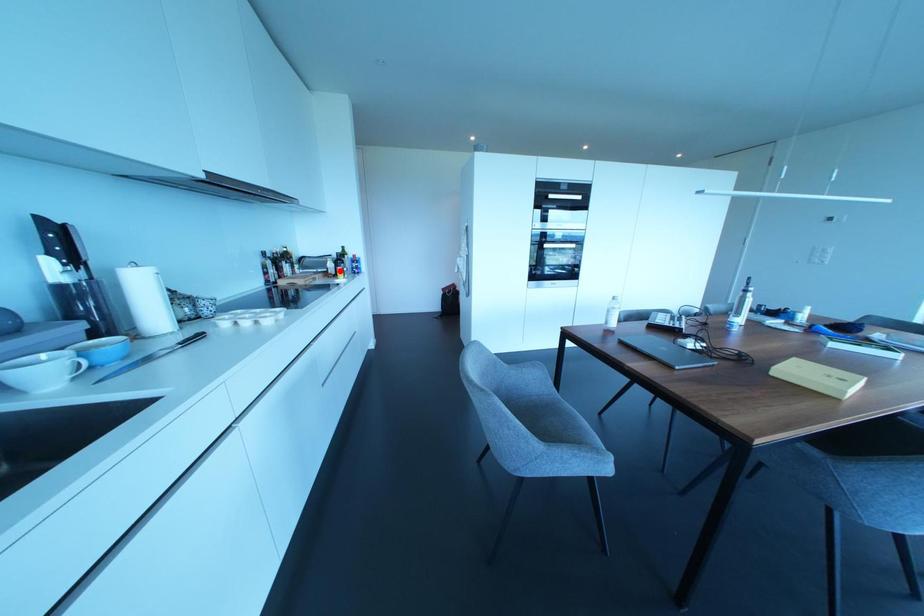
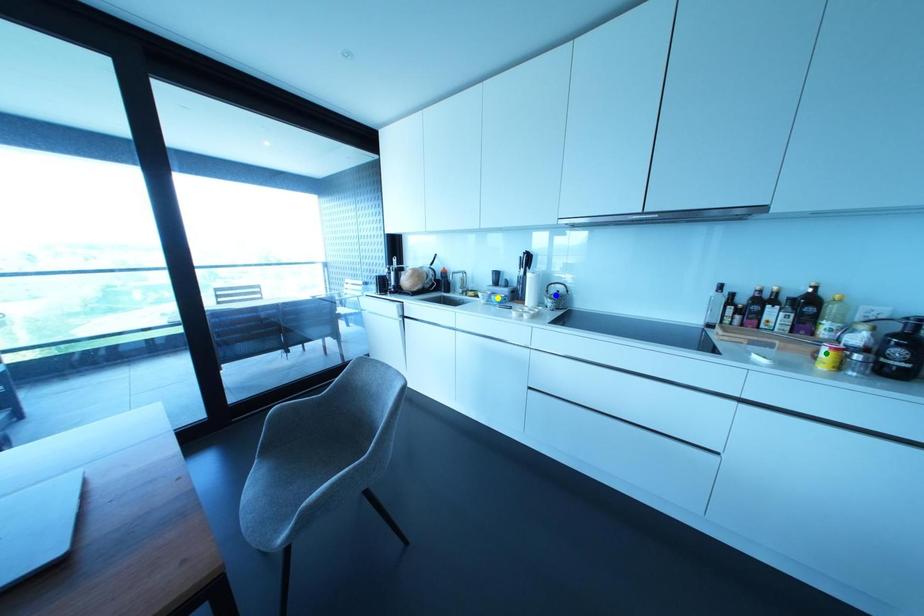
Question: I am providing you with two images of the same scene from different viewpoints. A red point is marked on the first image. You are given multiple points on the second image. Which mark in image 2 goes with the point in image 1?

Choices:
 (A) blue point
 (B) yellow point
 (C) green point

Answer: (C)